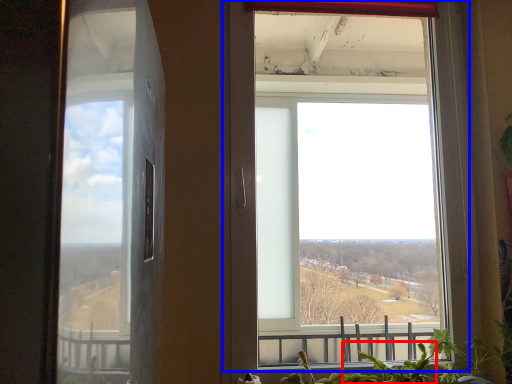
Question: Which object is further to the camera taking this photo, plant (highlighted by a red box) or window (highlighted by a blue box)?

Choices:
 (A) plant
 (B) window

Answer: (B)